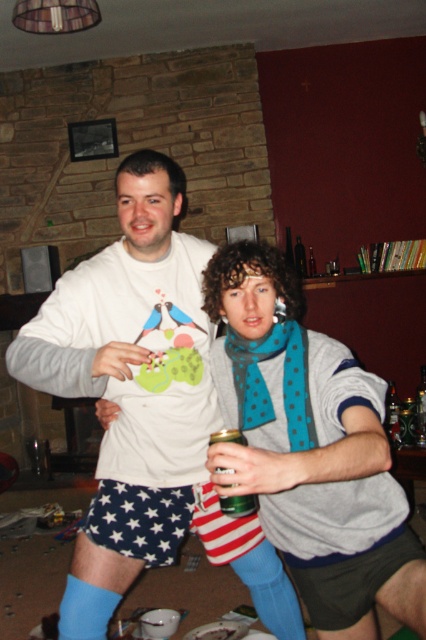
You are a fashion designer observing the two items in the image. Which item is positioned lower on the body between the white matte sweatshirt at center and the teal dotted scarf at center?

The white matte sweatshirt at center is located below the teal dotted scarf at center, so it is positioned lower on the body.

You are organizing a small party and need to place the white matte sweatshirt at center and the green glass can at center on a shelf. Which object should you place first to ensure they both fit on the shelf?

The white matte sweatshirt at center is much taller than the green glass can at center. Since the sweatshirt is taller, you should place the green glass can at center first to prevent it from being hidden or knocked over by the taller sweatshirt.